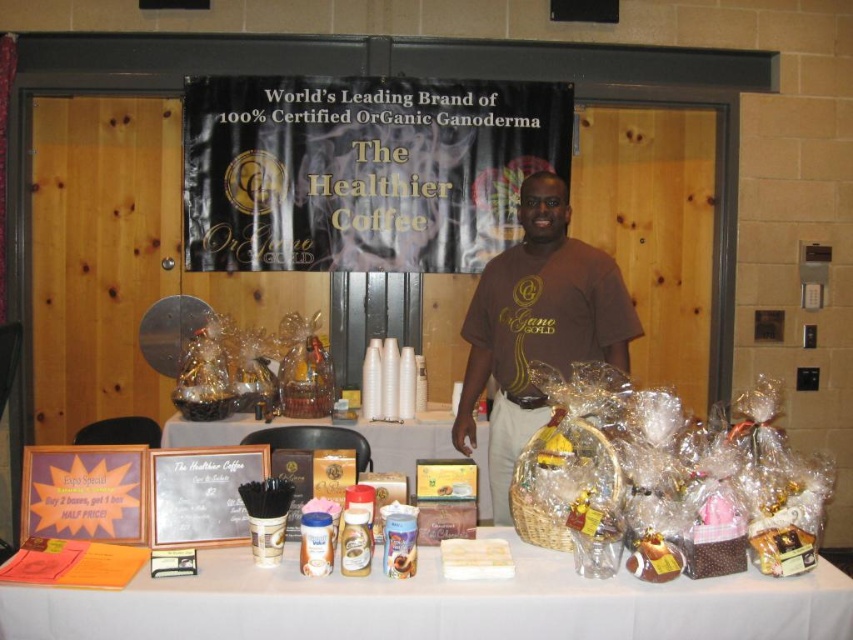
Question: Among these points, which one is farthest from the camera?

Choices:
 (A) (566, 282)
 (B) (326, 422)
 (C) (428, 620)

Answer: (B)

Question: Is matte brown wicker basket at center below wooden signboard at center?

Choices:
 (A) yes
 (B) no

Answer: (B)

Question: Based on their relative distances, which object is nearer to the wooden signboard at center?

Choices:
 (A) black wood frame at center
 (B) translucent plastic baskets at center
 (C) brown cotton t-shirt at center

Answer: (C)

Question: Is brown cotton t-shirt at center below wooden signboard at center?

Choices:
 (A) yes
 (B) no

Answer: (B)

Question: Among these points, which one is farthest from the camera?

Choices:
 (A) (363, 264)
 (B) (608, 467)
 (C) (39, 586)
 (D) (520, 385)

Answer: (A)

Question: Is brown cotton t-shirt at center bigger than black wood frame at center?

Choices:
 (A) no
 (B) yes

Answer: (B)